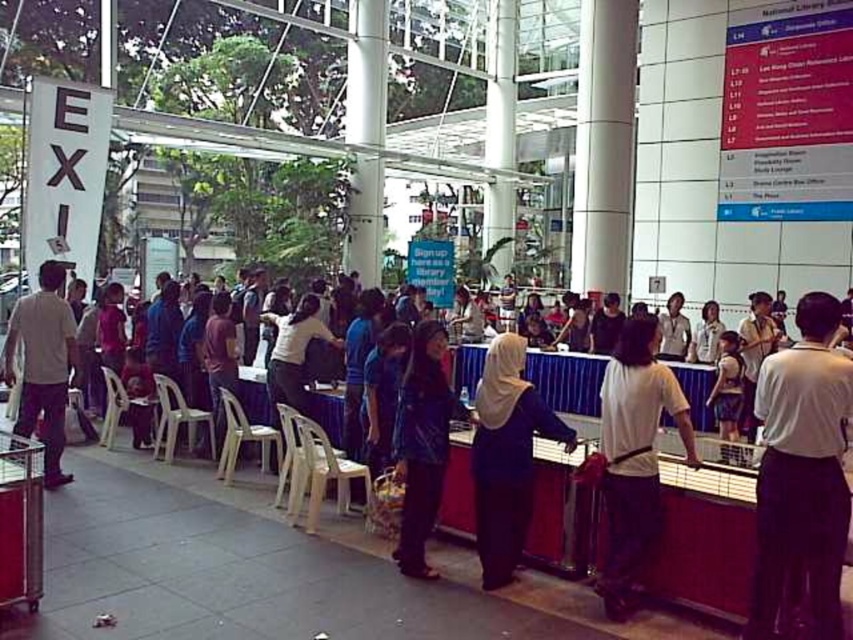
Does white cotton shirt at center come behind white matte shirt at left?

That is False.

Does white cotton shirt at center appear under white matte shirt at left?

Yes, white cotton shirt at center is below white matte shirt at left.

I want to click on white cotton shirt at center, so click(x=802, y=472).

This screenshot has width=853, height=640. I want to click on white cotton shirt at center, so click(x=802, y=472).

Between white cotton shirt at center and dark blue leather jacket at center, which one has more height?

With more height is white cotton shirt at center.

Between point (793, 476) and point (413, 472), which one is positioned behind?

Positioned behind is point (413, 472).

The image size is (853, 640). I want to click on white cotton shirt at center, so click(802, 472).

Does white matte shirt at center appear over purple matte hijab at center?

Yes.

Who is more forward, (683, 433) or (508, 362)?

Positioned in front is point (683, 433).

Who is more forward, (x=619, y=435) or (x=518, y=465)?

Point (x=619, y=435) is more forward.

Locate an element on the screen. The width and height of the screenshot is (853, 640). white matte shirt at center is located at coordinates (634, 458).